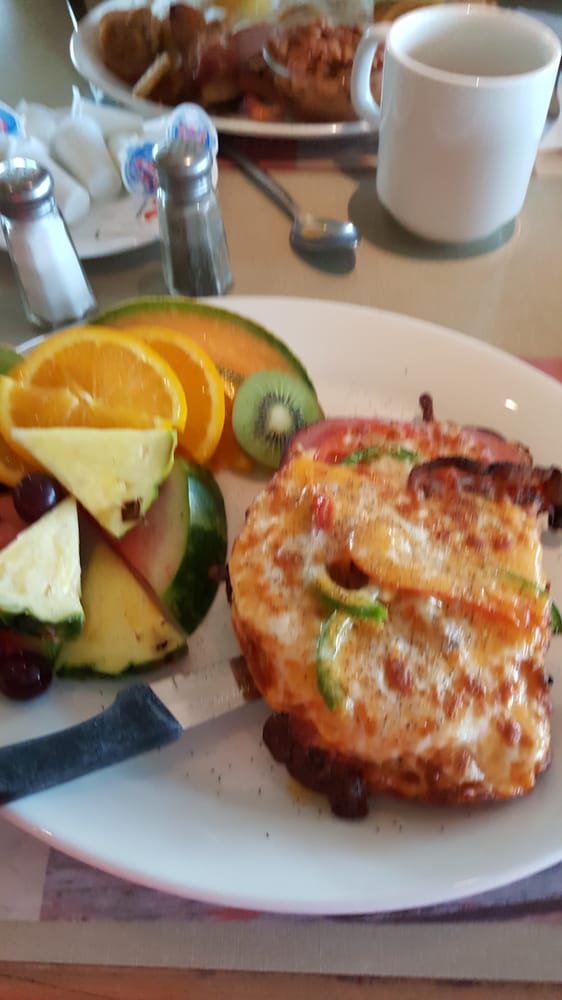
You are a GUI agent. You are given a task and a screenshot of the screen. Output one action in this format:
    pyautogui.click(x=<x>, y=<y>)
    Task: Click on the table
    Image resolution: width=562 pixels, height=1000 pixels.
    Given the screenshot: What is the action you would take?
    pyautogui.click(x=496, y=285), pyautogui.click(x=123, y=981), pyautogui.click(x=47, y=52)